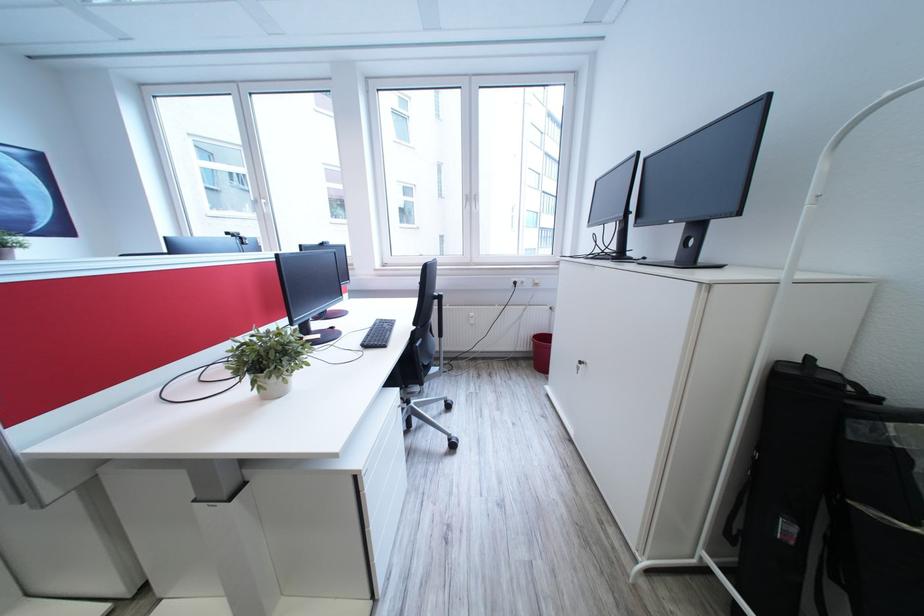
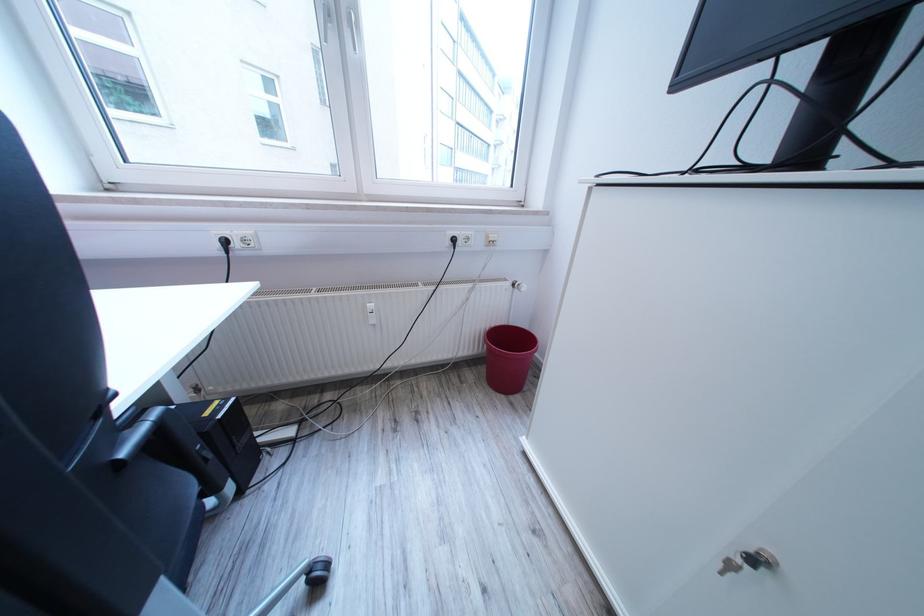
Locate, in the second image, the point that corresponds to (455,407) in the first image.

(315, 580)